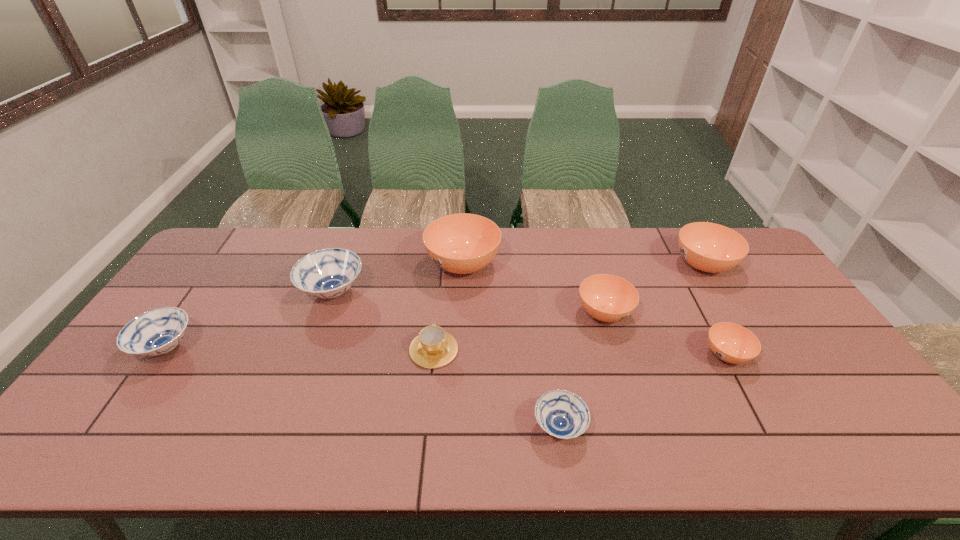
The image size is (960, 540). I want to click on free area in between the leftmost object and the brown cup, so click(300, 349).

Image resolution: width=960 pixels, height=540 pixels. I want to click on vacant area that lies between the sixth object from left to right and the fifth soup bowl from right to left, so click(x=534, y=289).

At what (x,y) coordinates should I click in order to perform the action: click on vacant point located between the third smallest peach soup bowl and the third soup bowl from left to right. Please return your answer as a coordinate pair (x, y). The height and width of the screenshot is (540, 960). Looking at the image, I should click on (583, 265).

Locate an element on the screen. free point between the leftmost peach soup bowl and the third smallest peach soup bowl is located at coordinates (583, 265).

In order to click on vacant area between the farthest blue soup bowl and the leftmost soup bowl in this screenshot , I will do click(250, 320).

You are a GUI agent. You are given a task and a screenshot of the screen. Output one action in this format:
    pyautogui.click(x=<x>, y=<y>)
    Task: Click on the free space between the leftmost peach soup bowl and the second smallest peach soup bowl
    
    Given the screenshot: What is the action you would take?
    pyautogui.click(x=534, y=289)

The image size is (960, 540). I want to click on vacant space that is in between the brown cup and the nearest object, so click(x=496, y=388).

Locate an element on the screen. vacant space in between the second biggest blue soup bowl and the nearest blue soup bowl is located at coordinates [363, 387].

Find the location of a particular element. the third closest object to the sixth object from left to right is located at coordinates [x=463, y=243].

Choose which object is the sixth nearest neighbor to the third soup bowl from left to right. Please provide its 2D coordinates. Your answer should be formatted as a tuple, i.e. [(x, y)], where the tuple contains the x and y coordinates of a point satisfying the conditions above.

[(709, 247)]